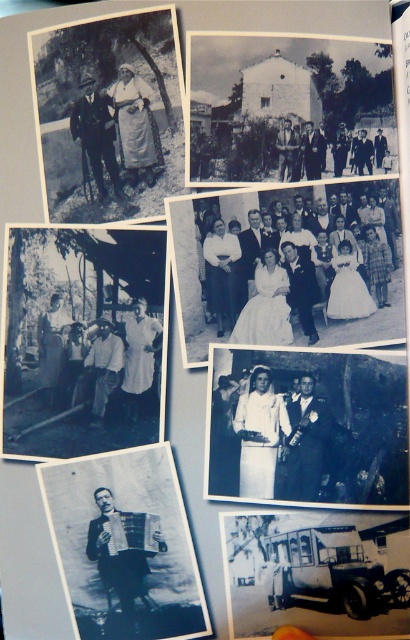
From the picture: Which of these two, white satin dress at center or black fabric accordion at center, stands shorter?

black fabric accordion at center

Describe the element at coordinates (312, 252) in the screenshot. I see `white satin dress at center` at that location.

Between point (291, 221) and point (107, 493), which one is positioned behind?

The point (107, 493) is behind.

The height and width of the screenshot is (640, 410). In order to click on white satin dress at center in this screenshot , I will do 312,252.